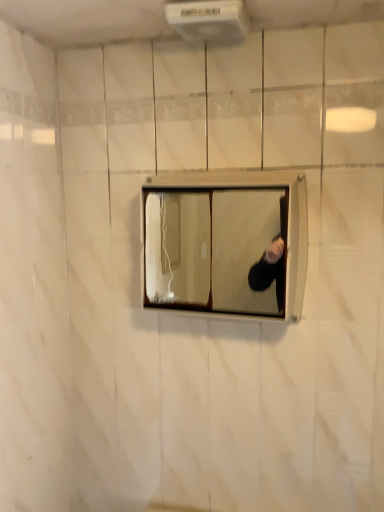
Where is `matte wooden medicine cabinet at center`? matte wooden medicine cabinet at center is located at coordinates (225, 243).

Describe the element at coordinates (225, 243) in the screenshot. I see `matte wooden medicine cabinet at center` at that location.

Locate an element on the screen. white plastic air conditioner at upper center is located at coordinates (209, 20).

What do you see at coordinates (209, 20) in the screenshot? I see `white plastic air conditioner at upper center` at bounding box center [209, 20].

Locate an element on the screen. The height and width of the screenshot is (512, 384). matte wooden medicine cabinet at center is located at coordinates (225, 243).

Which is more to the right, white plastic air conditioner at upper center or matte wooden medicine cabinet at center?

matte wooden medicine cabinet at center is more to the right.

Between white plastic air conditioner at upper center and matte wooden medicine cabinet at center, which one is positioned in front?

white plastic air conditioner at upper center is more forward.

Does point (211, 3) come farther from viewer compared to point (206, 308)?

No.

Consider the image. From the image's perspective, relative to matte wooden medicine cabinet at center, is white plastic air conditioner at upper center above or below?

white plastic air conditioner at upper center is situated higher than matte wooden medicine cabinet at center in the image.

From a real-world perspective, is white plastic air conditioner at upper center physically above matte wooden medicine cabinet at center?

Indeed, from a real-world perspective, white plastic air conditioner at upper center stands above matte wooden medicine cabinet at center.

Which of these two, white plastic air conditioner at upper center or matte wooden medicine cabinet at center, is wider?

white plastic air conditioner at upper center is wider.

Can you confirm if white plastic air conditioner at upper center is shorter than matte wooden medicine cabinet at center?

Correct, white plastic air conditioner at upper center is not as tall as matte wooden medicine cabinet at center.

Looking at the image, does white plastic air conditioner at upper center seem bigger or smaller compared to matte wooden medicine cabinet at center?

In the image, white plastic air conditioner at upper center appears to be smaller than matte wooden medicine cabinet at center.

Is matte wooden medicine cabinet at center inside white plastic air conditioner at upper center?

No, white plastic air conditioner at upper center does not contain matte wooden medicine cabinet at center.

Is white plastic air conditioner at upper center positioned far away from matte wooden medicine cabinet at center?

No, white plastic air conditioner at upper center is in close proximity to matte wooden medicine cabinet at center.

Could you tell me if white plastic air conditioner at upper center is turned towards matte wooden medicine cabinet at center?

No, white plastic air conditioner at upper center is not facing towards matte wooden medicine cabinet at center.

Locate an element on the screen. medicine cabinet behind the white plastic air conditioner at upper center is located at coordinates (225, 243).

Based on their positions, is matte wooden medicine cabinet at center located to the left or right of white plastic air conditioner at upper center?

In the image, matte wooden medicine cabinet at center appears on the right side of white plastic air conditioner at upper center.

Who is more distant, matte wooden medicine cabinet at center or white plastic air conditioner at upper center?

matte wooden medicine cabinet at center is behind.

Between point (293, 290) and point (221, 32), which one is positioned in front?

The point (221, 32) is more forward.

From the image's perspective, is matte wooden medicine cabinet at center located beneath white plastic air conditioner at upper center?

Indeed, from the image's perspective, matte wooden medicine cabinet at center is shown beneath white plastic air conditioner at upper center.

From a real-world perspective, is matte wooden medicine cabinet at center positioned under white plastic air conditioner at upper center based on gravity?

A: Yes, from a real-world perspective, matte wooden medicine cabinet at center is below white plastic air conditioner at upper center.

Can you confirm if matte wooden medicine cabinet at center is thinner than white plastic air conditioner at upper center?

Correct, the width of matte wooden medicine cabinet at center is less than that of white plastic air conditioner at upper center.

Between matte wooden medicine cabinet at center and white plastic air conditioner at upper center, which one has less height?

white plastic air conditioner at upper center.

Looking at the image, does matte wooden medicine cabinet at center seem bigger or smaller compared to white plastic air conditioner at upper center?

In the image, matte wooden medicine cabinet at center appears to be larger than white plastic air conditioner at upper center.

Is matte wooden medicine cabinet at center positioned beyond the bounds of white plastic air conditioner at upper center?

Yes, matte wooden medicine cabinet at center is located beyond the bounds of white plastic air conditioner at upper center.

Would you say matte wooden medicine cabinet at center is a long distance from white plastic air conditioner at upper center?

No, matte wooden medicine cabinet at center is not far from white plastic air conditioner at upper center.

Could you tell me if matte wooden medicine cabinet at center is facing white plastic air conditioner at upper center?

No, matte wooden medicine cabinet at center is not turned towards white plastic air conditioner at upper center.

How different are the orientations of matte wooden medicine cabinet at center and white plastic air conditioner at upper center in degrees?

2.61 degrees separate the facing orientations of matte wooden medicine cabinet at center and white plastic air conditioner at upper center.

Locate an element on the screen. medicine cabinet located on the right of white plastic air conditioner at upper center is located at coordinates (225, 243).

Find the location of a particular element. air conditioner above the matte wooden medicine cabinet at center (from the image's perspective) is located at coordinates (209, 20).

You are a GUI agent. You are given a task and a screenshot of the screen. Output one action in this format:
    pyautogui.click(x=<x>, y=<y>)
    Task: Click on the medicine cabinet below the white plastic air conditioner at upper center (from the image's perspective)
    The image size is (384, 512).
    Given the screenshot: What is the action you would take?
    pyautogui.click(x=225, y=243)